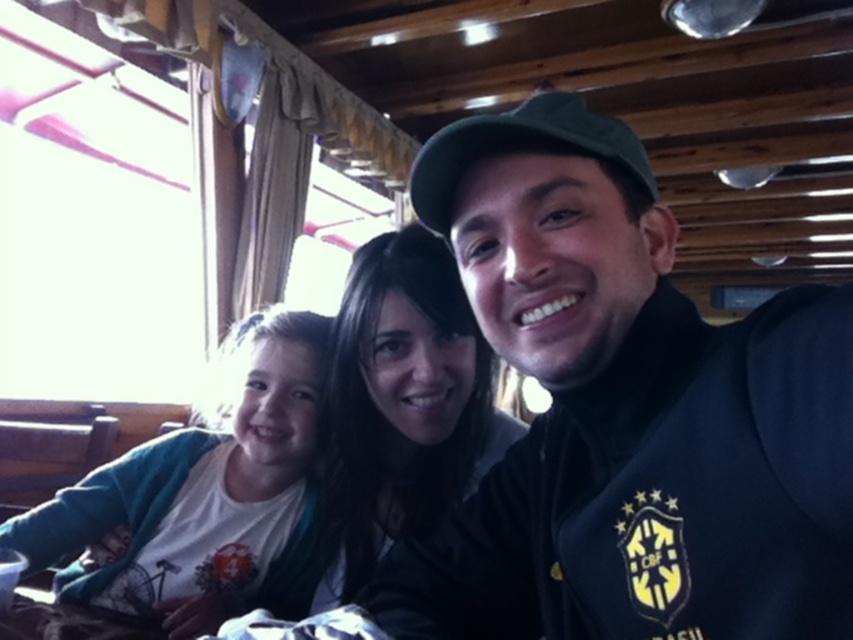
You are standing in the boat and need to hand a document to the person wearing the white cotton shirt at left. Based on their position relative to you, in which direction should you move to reach them?

The white cotton shirt at left is located at point [201,506], so you should move towards the left side of the boat to reach them.